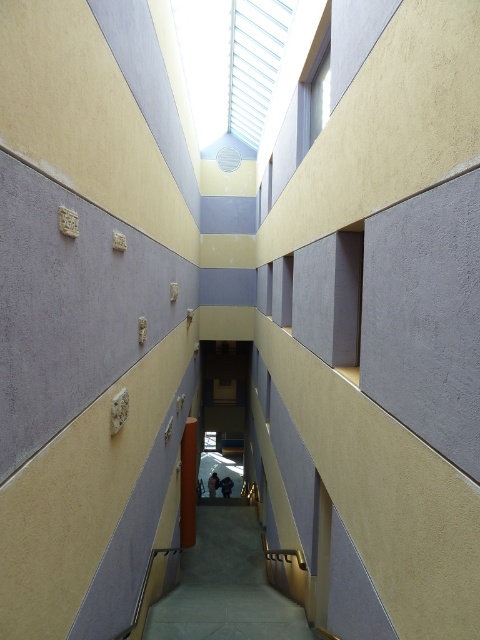
Is point (196, 538) less distant than point (192, 452)?

No, it is not.

Measure the distance between smooth concrete stairs at center and smooth brown wooden pillar at center.

smooth concrete stairs at center is 5.41 feet from smooth brown wooden pillar at center.

Describe the element at coordinates (226, 586) in the screenshot. The width and height of the screenshot is (480, 640). I see `smooth concrete stairs at center` at that location.

Locate an element on the screen. smooth concrete stairs at center is located at coordinates (226, 586).